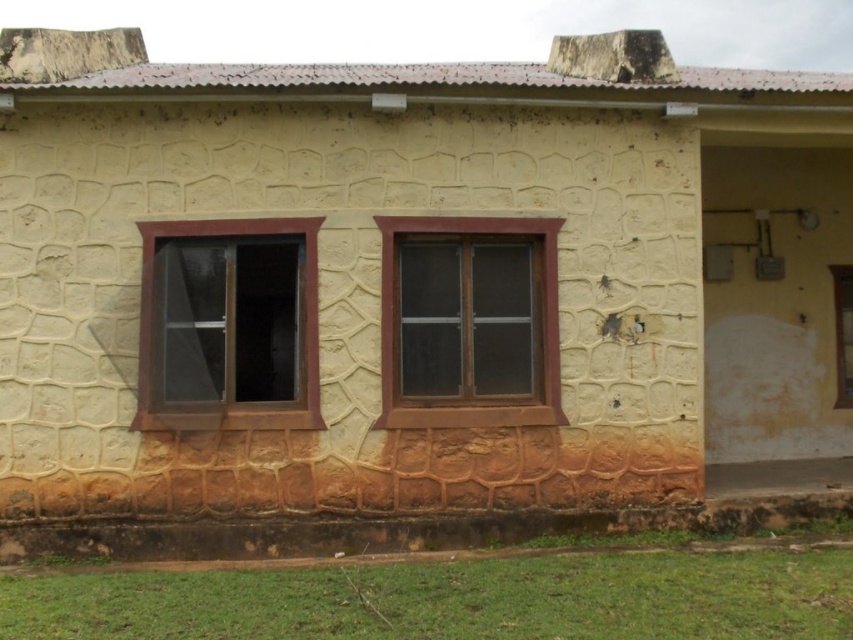
Can you confirm if brown wooden window at center is shorter than clear glass window at center right?

Incorrect, brown wooden window at center's height does not fall short of clear glass window at center right's.

Is brown wooden window at center thinner than clear glass window at center right?

No, brown wooden window at center is not thinner than clear glass window at center right.

From the picture: Who is more distant from viewer, (392, 420) or (840, 355)?

The point (840, 355) is behind.

The image size is (853, 640). What are the coordinates of `brown wooden window at center` in the screenshot? It's located at (541, 326).

Which is in front, point (144, 420) or point (850, 289)?

Point (144, 420) is in front.

Is the position of brown wooden window at left more distant than that of clear glass window at center right?

No, it is in front of clear glass window at center right.

Measure the distance between brown wooden window at left and camera.

The distance of brown wooden window at left from camera is 23.87 feet.

This screenshot has width=853, height=640. In order to click on brown wooden window at left in this screenshot , I will do `click(218, 326)`.

Locate an element on the screen. brown wooden window at left is located at coordinates (218, 326).

Can you confirm if brown wooden window at left is taller than brown wooden window at center?

In fact, brown wooden window at left may be shorter than brown wooden window at center.

Is point (155, 237) farther from viewer compared to point (547, 321)?

No, (155, 237) is closer to viewer.

Locate an element on the screen. This screenshot has width=853, height=640. brown wooden window at left is located at coordinates (218, 326).